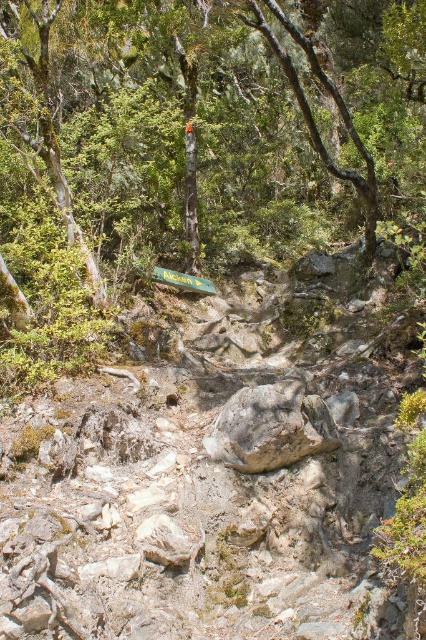
You are a hiker trying to navigate the rugged trail. You notice a green leafy tree at center and a gray rough rock at center. Which object would you need to avoid stepping on to prevent slipping?

The gray rough rock at center has a rough surface and might be slippery when wet, so you should avoid stepping on it. The green leafy tree at center is bigger but not an obstacle for foot placement.

You are standing at the starting point of the trail and want to reach the green leafy tree at center. Which direction should you head towards?

The green leafy tree at center is located at point coordinates of (201, 140), so you should head towards the center of the trail to reach it.

You are a hiker who wants to place a 4 meter long wooden board between the green leafy tree at center and the gray rough rock at center to cross over a small stream. Will the board reach both ends?

The distance between the green leafy tree at center and the gray rough rock at center is 4.35 meters. Since the board is only 4 meters long, it will be 35 centimeters short and won not reach both ends.